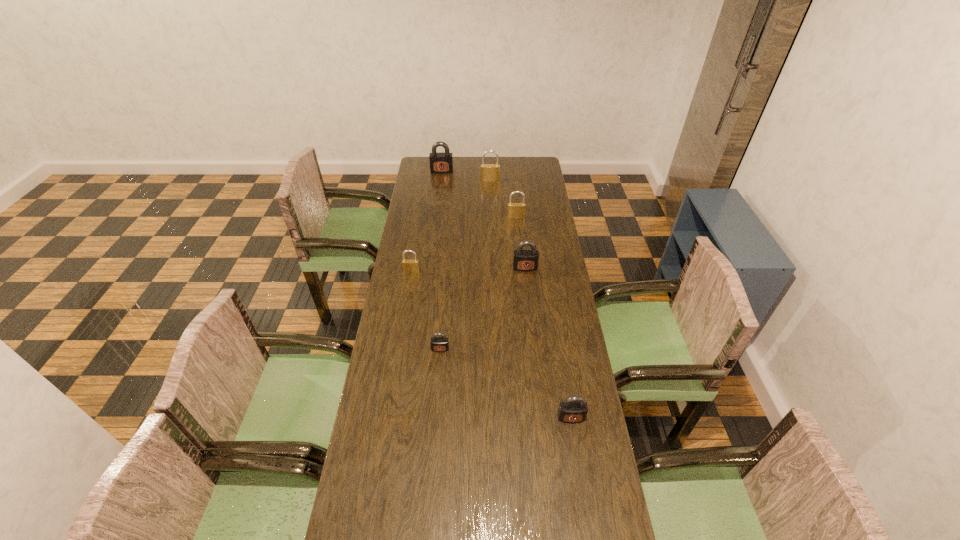
At what (x,y) coordinates should I click in order to perform the action: click on the farthest padlock. Please return your answer as a coordinate pair (x, y). Looking at the image, I should click on (442, 162).

I want to click on the biggest gray padlock, so click(442, 162).

The image size is (960, 540). What are the coordinates of `the fourth object from left to right` in the screenshot? It's located at (489, 172).

You are a GUI agent. You are given a task and a screenshot of the screen. Output one action in this format:
    pyautogui.click(x=<x>, y=<y>)
    Task: Click on the farthest brass padlock
    The width and height of the screenshot is (960, 540).
    Given the screenshot: What is the action you would take?
    pyautogui.click(x=489, y=172)

Where is `the second smallest brass padlock`? the second smallest brass padlock is located at coordinates (514, 210).

You are a GUI agent. You are given a task and a screenshot of the screen. Output one action in this format:
    pyautogui.click(x=<x>, y=<y>)
    Task: Click on the third farthest object
    The height and width of the screenshot is (540, 960).
    Given the screenshot: What is the action you would take?
    pyautogui.click(x=514, y=210)

The image size is (960, 540). What are the coordinates of `the third smallest gray padlock` in the screenshot? It's located at (525, 260).

The image size is (960, 540). What are the coordinates of `the third gray padlock from left to right` in the screenshot? It's located at (525, 260).

I want to click on the rightmost padlock, so click(574, 409).

This screenshot has height=540, width=960. What are the coordinates of `the nearest padlock` in the screenshot? It's located at 574,409.